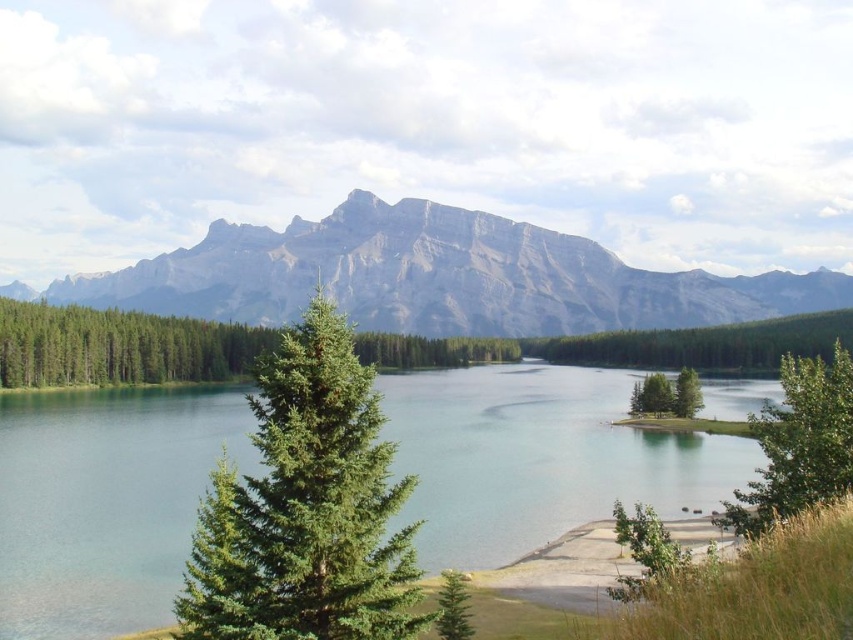
Does point (328, 288) lie in front of point (646, 385)?

No, it is not.

Between gray rocky mountain at upper center and green matte tree at center, which one has less height?

green matte tree at center is shorter.

The image size is (853, 640). Identify the location of gray rocky mountain at upper center. (434, 276).

At what (x,y) coordinates should I click in order to perform the action: click on gray rocky mountain at upper center. Please return your answer as a coordinate pair (x, y). The height and width of the screenshot is (640, 853). Looking at the image, I should click on (434, 276).

Identify the location of clear water at center. The height and width of the screenshot is (640, 853). (538, 458).

Between point (126, 564) and point (659, 410), which one is positioned in front?

Positioned in front is point (126, 564).

Image resolution: width=853 pixels, height=640 pixels. What do you see at coordinates (538, 458) in the screenshot?
I see `clear water at center` at bounding box center [538, 458].

I want to click on clear water at center, so click(538, 458).

Does green matte tree at center appear on the left side of green matte tree at lower right?

Yes, green matte tree at center is to the left of green matte tree at lower right.

This screenshot has width=853, height=640. Describe the element at coordinates (653, 396) in the screenshot. I see `green matte tree at center` at that location.

Measure the distance between point [648,406] and camera.

The distance of point [648,406] from camera is 601.42 feet.

Find the location of a particular element. The width and height of the screenshot is (853, 640). green matte tree at center is located at coordinates (653, 396).